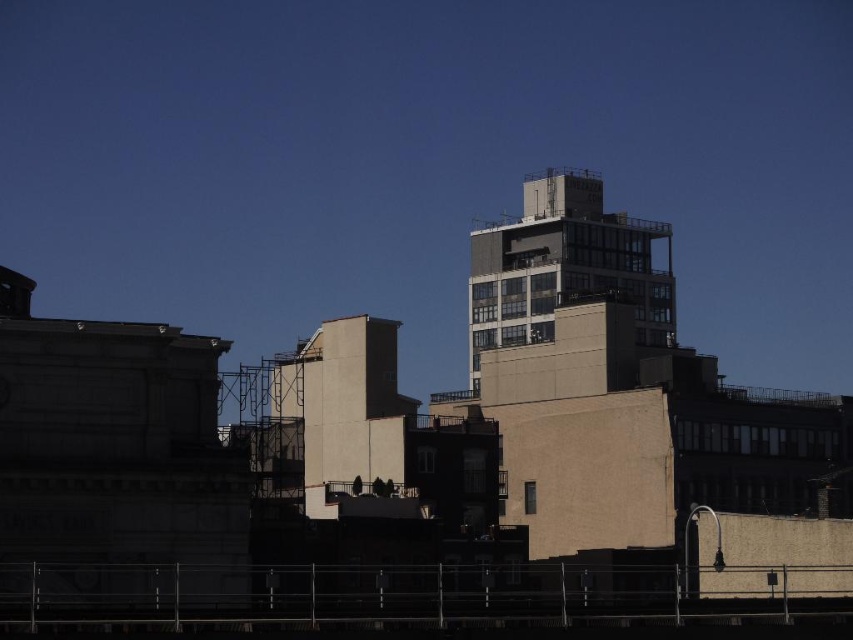
Question: Does concrete building at center appear over smooth beige wall at center?

Choices:
 (A) yes
 (B) no

Answer: (A)

Question: Which point is closer to the camera taking this photo?

Choices:
 (A) (347, 480)
 (B) (492, 324)

Answer: (A)

Question: Which of the following is the closest to the observer?

Choices:
 (A) smooth beige wall at center
 (B) concrete building at center

Answer: (A)

Question: Is concrete building at center below smooth beige wall at center?

Choices:
 (A) yes
 (B) no

Answer: (B)

Question: Can you confirm if concrete building at center is positioned below smooth beige wall at center?

Choices:
 (A) yes
 (B) no

Answer: (B)